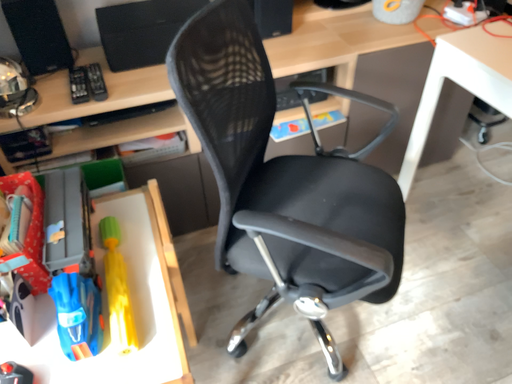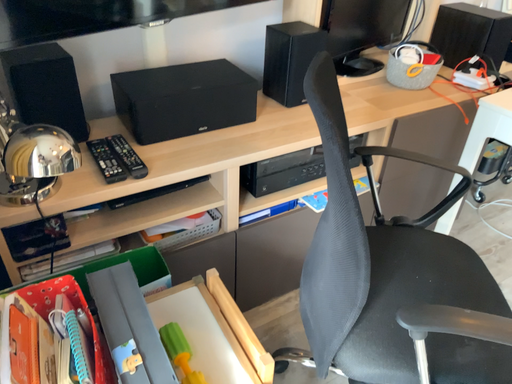
Question: How did the camera likely rotate when shooting the video?

Choices:
 (A) rotated left
 (B) rotated right

Answer: (B)